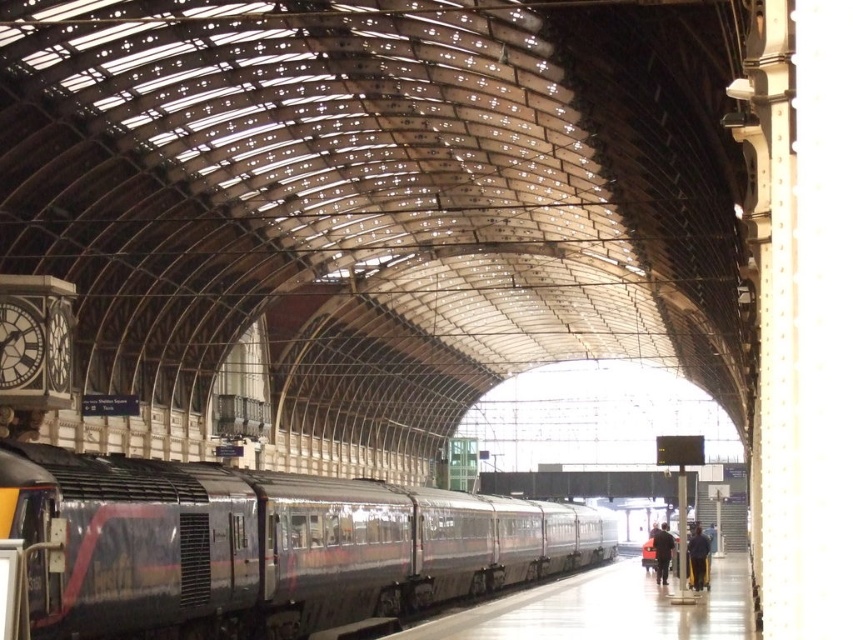
You are standing on the platform of the grand train station. You see a polished dark gray train at center and a dark blue jacket at center. Which object is closer to the ground?

The polished dark gray train at center is closer to the ground because it is positioned below the dark blue jacket at center.